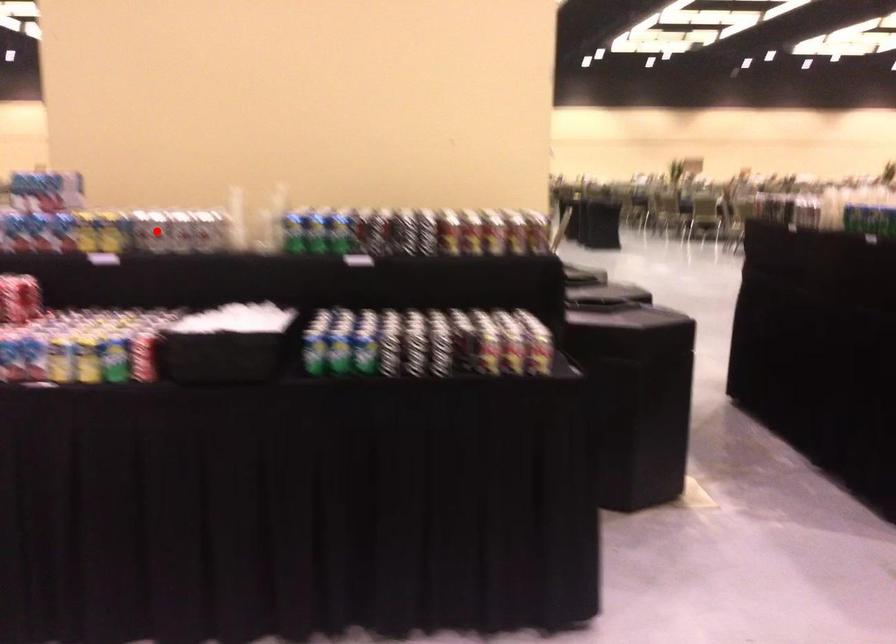
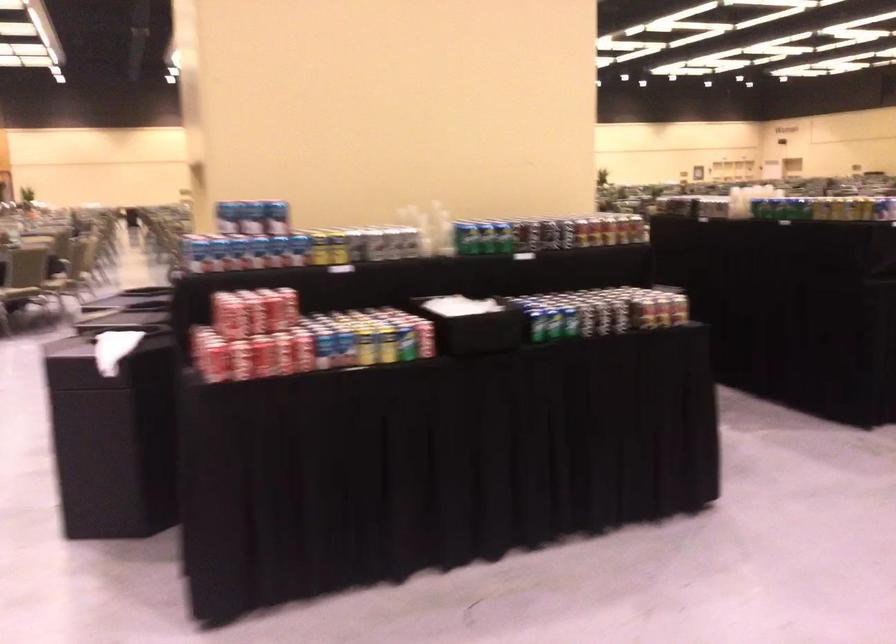
The point at the highlighted location is marked in the first image. Where is the corresponding point in the second image?

(375, 243)